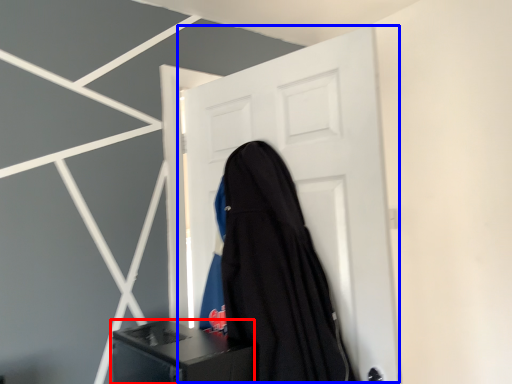
Question: Which point is further to the camera, furniture (highlighted by a red box) or door (highlighted by a blue box)?

Choices:
 (A) furniture
 (B) door

Answer: (B)